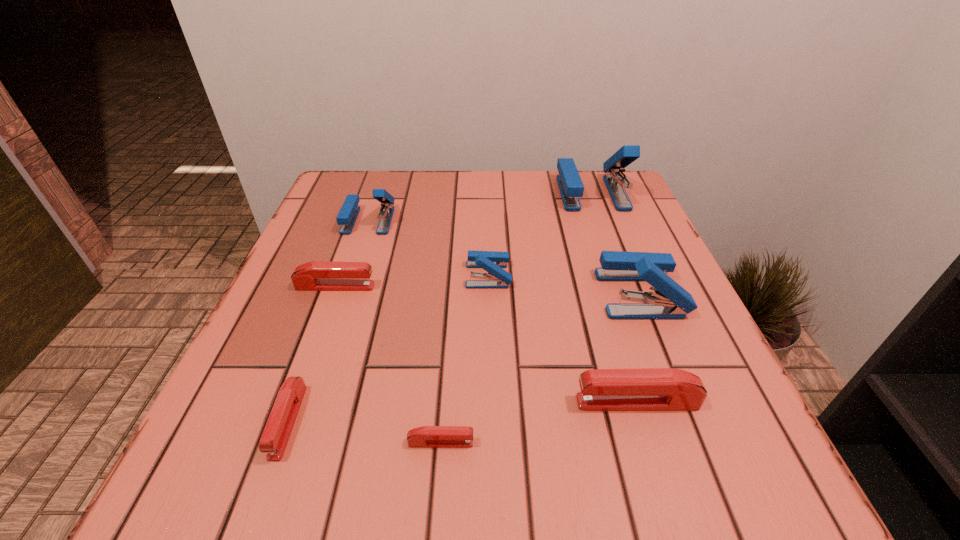
Locate an element on the screen. The image size is (960, 540). the second shortest stapler is located at coordinates (277, 431).

The height and width of the screenshot is (540, 960). Identify the location of the second smallest red stapler. (277, 431).

Locate an element on the screen. the second red stapler from right to left is located at coordinates (426, 436).

I want to click on the smallest red stapler, so click(x=426, y=436).

The height and width of the screenshot is (540, 960). Identify the location of vacant space located on the left of the tallest stapler. (540, 193).

Locate an element on the screen. vacant region located 0.140m on the left of the second biggest blue stapler is located at coordinates 527,294.

Locate an element on the screen. The height and width of the screenshot is (540, 960). free space located on the back of the third tallest object is located at coordinates (377, 193).

Locate an element on the screen. This screenshot has height=540, width=960. vacant space positioned on the left of the third blue stapler from right to left is located at coordinates (325, 275).

This screenshot has width=960, height=540. Identify the location of free space located on the front-facing side of the rightmost red stapler. (390, 402).

I want to click on free space located on the front-facing side of the rightmost red stapler, so click(537, 402).